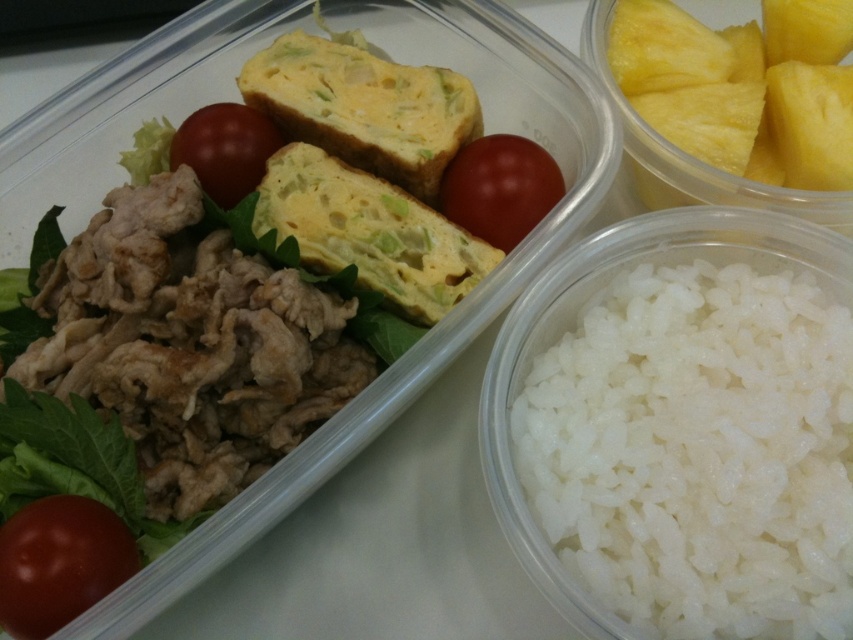
Can you confirm if red matte tomato at lower left is positioned to the right of glossy red tomato at upper center?

No, red matte tomato at lower left is not to the right of glossy red tomato at upper center.

Which is more to the right, red matte tomato at lower left or glossy red tomato at upper center?

Positioned to the right is glossy red tomato at upper center.

Is point (126, 556) in front of point (263, 131)?

That is True.

At what (x,y) coordinates should I click in order to perform the action: click on red matte tomato at lower left. Please return your answer as a coordinate pair (x, y). This screenshot has height=640, width=853. Looking at the image, I should click on coord(59,563).

Is red matte tomato at center above glossy red tomato at upper center?

Incorrect, red matte tomato at center is not positioned above glossy red tomato at upper center.

Can you confirm if red matte tomato at center is positioned below glossy red tomato at upper center?

Correct, red matte tomato at center is located below glossy red tomato at upper center.

The height and width of the screenshot is (640, 853). Identify the location of red matte tomato at center. (498, 188).

Measure the distance between white polished rice at lower right and red matte tomato at center.

12.61 inches

The image size is (853, 640). Describe the element at coordinates (698, 451) in the screenshot. I see `white polished rice at lower right` at that location.

The image size is (853, 640). What are the coordinates of `white polished rice at lower right` in the screenshot? It's located at (698, 451).